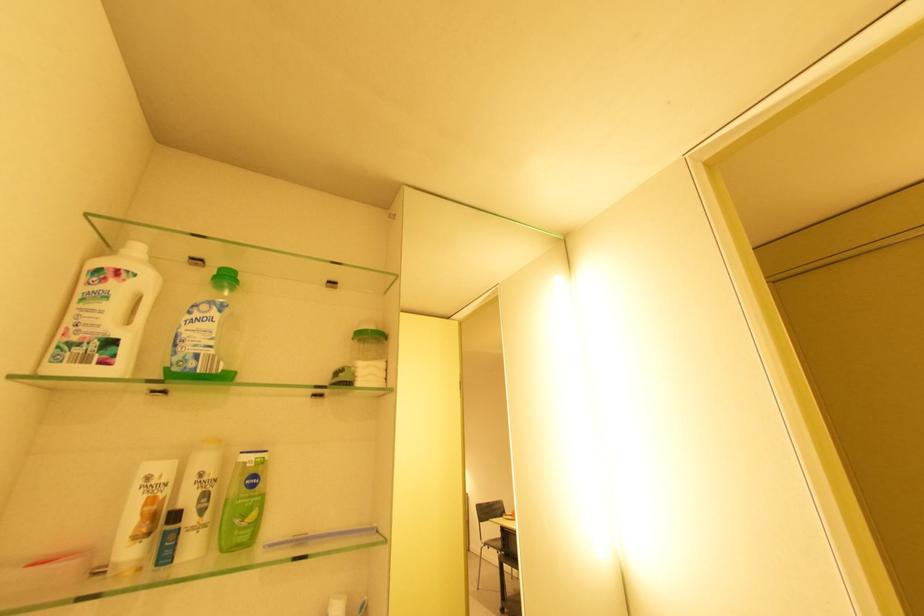
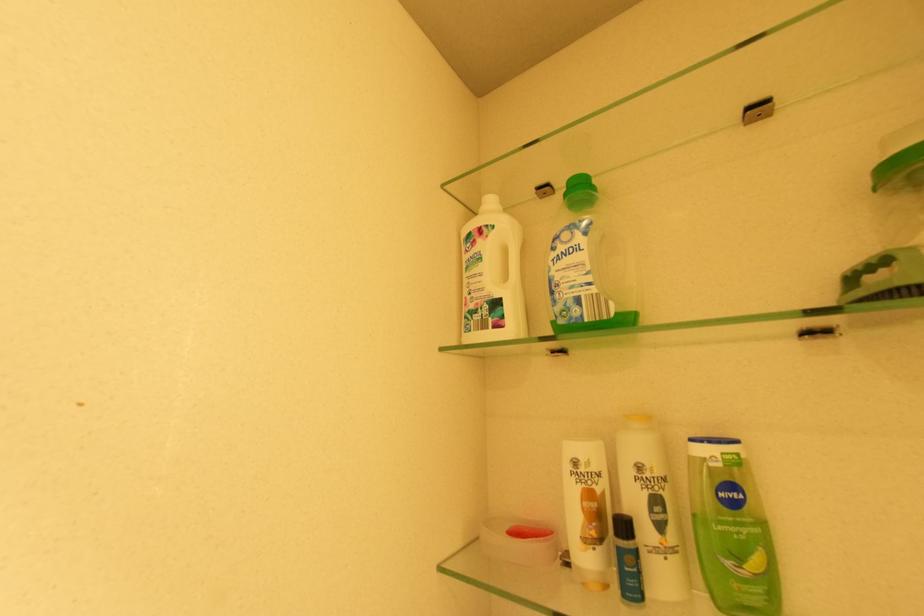
Question: I am providing you with two images of the same scene from different viewpoints. Please identify which objects are invisible in image2.

Choices:
 (A) green bottle cap
 (B) clear bottle handle
 (C) white bottle handle
 (D) none of these

Answer: (D)